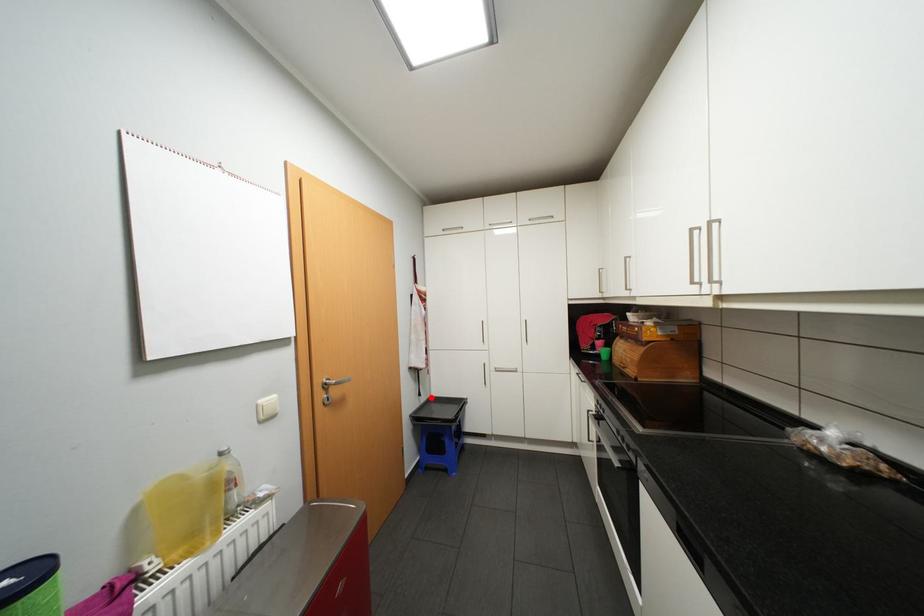
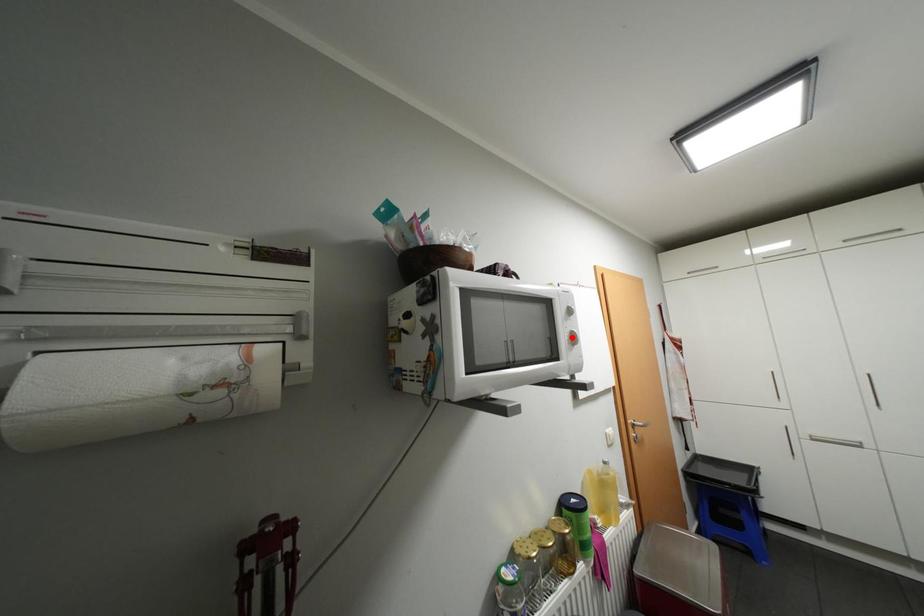
I am providing you with two images of the same scene from different viewpoints. A red point is marked on the first image and another point is marked on the second image. Are the points marked in image1 and image2 representing the same 3D position?

No